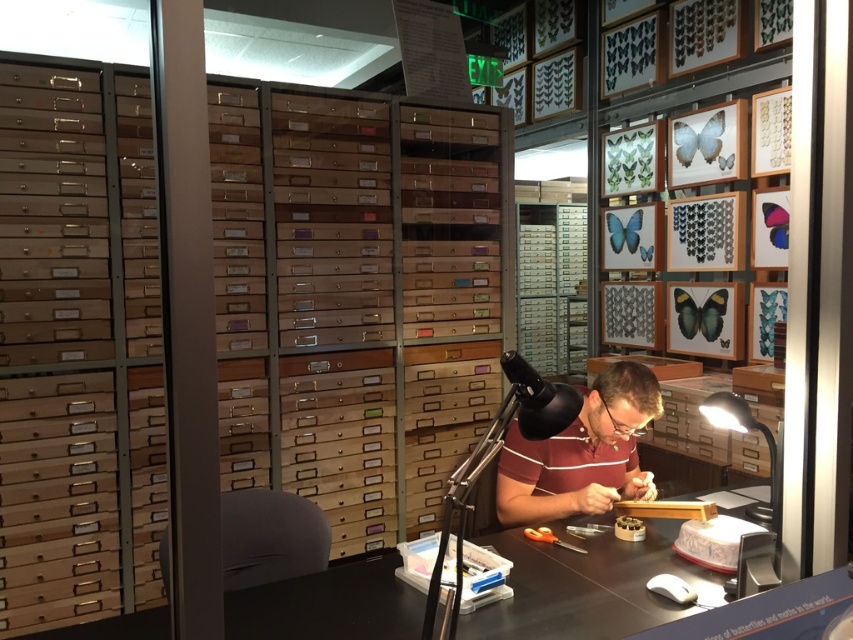
Question: Which of the following is the closest to the observer?

Choices:
 (A) wooden desk at center
 (B) maroon striped shirt at center

Answer: (A)

Question: Is wooden desk at center positioned before maroon striped shirt at center?

Choices:
 (A) yes
 (B) no

Answer: (A)

Question: Does wooden desk at center appear on the right side of maroon striped shirt at center?

Choices:
 (A) no
 (B) yes

Answer: (A)

Question: Can you confirm if wooden desk at center is positioned to the right of maroon striped shirt at center?

Choices:
 (A) no
 (B) yes

Answer: (A)

Question: Which point is farther from the camera taking this photo?

Choices:
 (A) (625, 419)
 (B) (511, 620)

Answer: (A)

Question: Which of the following is the closest to the observer?

Choices:
 (A) (639, 580)
 (B) (625, 364)

Answer: (A)